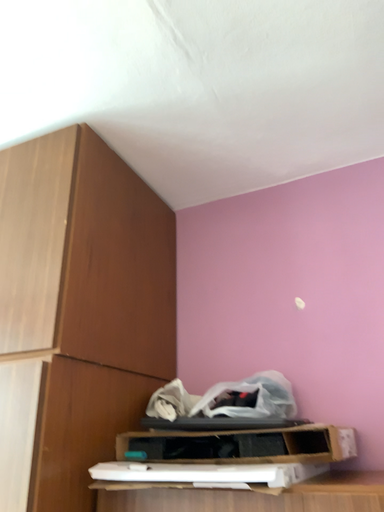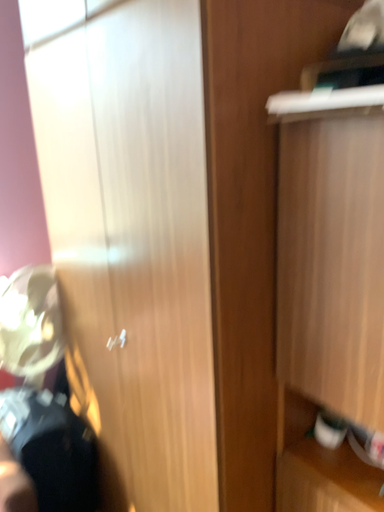
Question: How did the camera likely rotate when shooting the video?

Choices:
 (A) rotated left
 (B) rotated right

Answer: (A)